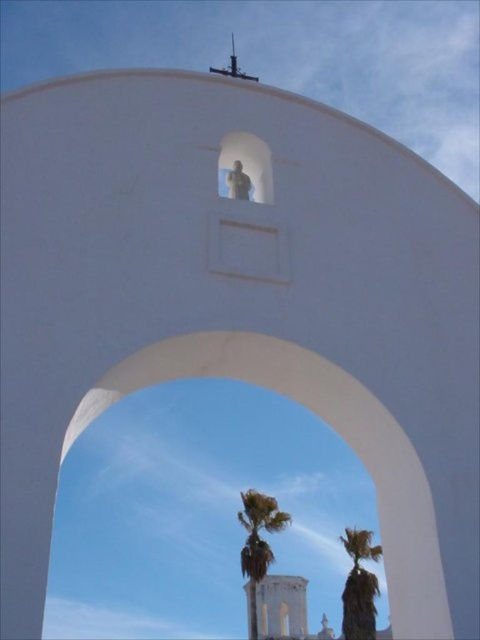
Question: Which point is farther from the camera taking this photo?

Choices:
 (A) (251, 499)
 (B) (376, 586)

Answer: (A)

Question: Is green leafy palm at center thinner than green leafy palm tree at center?

Choices:
 (A) no
 (B) yes

Answer: (A)

Question: Can you confirm if green leafy palm at center is positioned to the left of green leafy palm tree at center?

Choices:
 (A) yes
 (B) no

Answer: (A)

Question: Which object is farther from the camera taking this photo?

Choices:
 (A) green leafy palm tree at center
 (B) green leafy palm at center

Answer: (A)

Question: Does green leafy palm at center have a smaller size compared to green leafy palm tree at center?

Choices:
 (A) yes
 (B) no

Answer: (B)